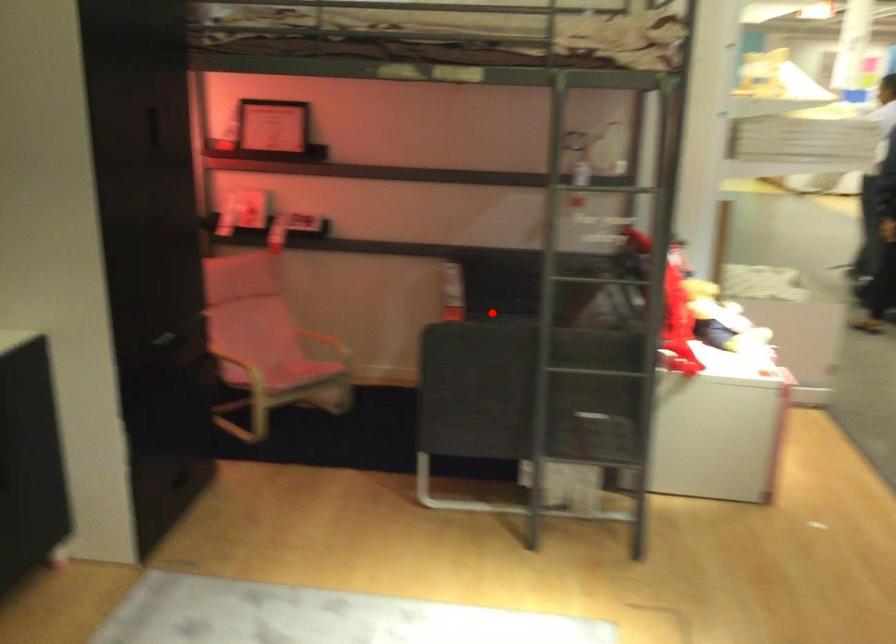
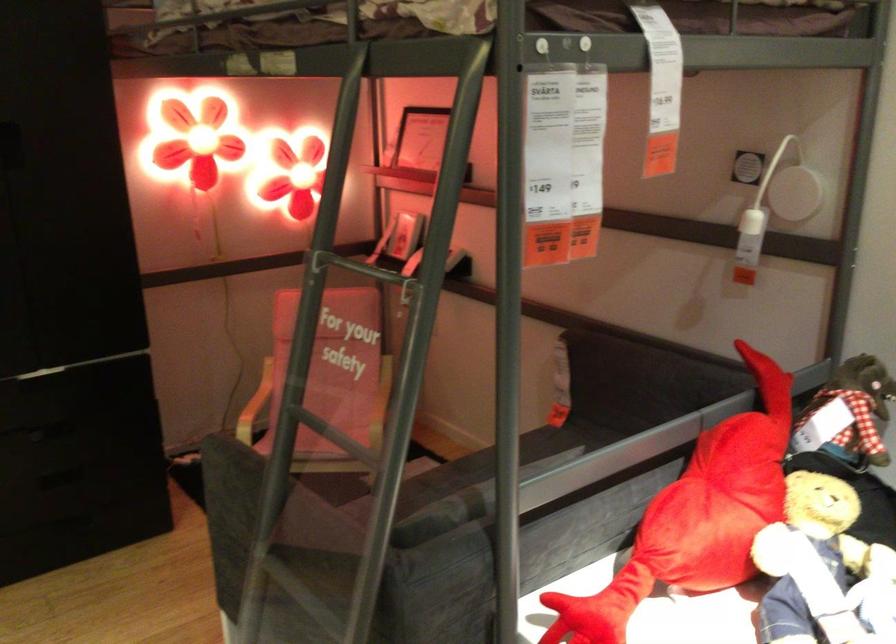
Where in the second image is the point corresponding to the highlighted location from the first image?

(567, 437)